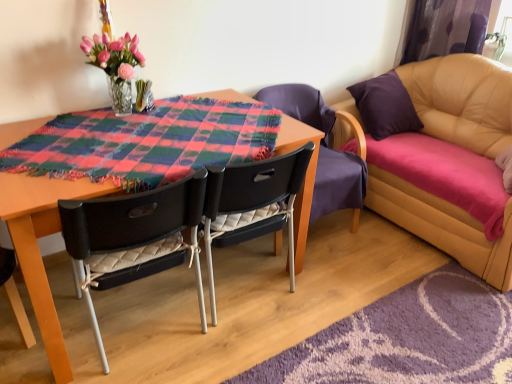
The height and width of the screenshot is (384, 512). Identify the location of black quilted fabric chair at center, the third chair positioned from the right. (133, 235).

Locate an element on the screen. black quilted chair at center, the third chair from the left is located at coordinates (324, 149).

The width and height of the screenshot is (512, 384). I want to click on purple shaggy rug at lower right, so click(407, 338).

The height and width of the screenshot is (384, 512). I want to click on purple fabric curtain at upper right, so click(x=445, y=28).

Which object is wider, black plastic chair at center, the second chair from the right, or black quilted chair at center, marked as the 1th chair in a right-to-left arrangement?

black quilted chair at center, marked as the 1th chair in a right-to-left arrangement, is wider.

Is black plastic chair at center, marked as the second chair in a left-to-right arrangement, closer to the viewer compared to black quilted chair at center, the third chair from the left?

That is True.

Who is shorter, black plastic chair at center, the second chair from the right, or black quilted chair at center, marked as the 1th chair in a right-to-left arrangement?

With less height is black plastic chair at center, the second chair from the right.

Which object is positioned more to the left, black plastic chair at center, marked as the second chair in a left-to-right arrangement, or black quilted chair at center, marked as the 1th chair in a right-to-left arrangement?

black plastic chair at center, marked as the second chair in a left-to-right arrangement.

Do you think black plastic chair at center, the second chair from the right, is within black quilted fabric chair at center, acting as the first chair starting from the left, or outside of it?

black plastic chair at center, the second chair from the right, cannot be found inside black quilted fabric chair at center, acting as the first chair starting from the left.

Does black plastic chair at center, marked as the second chair in a left-to-right arrangement, have a greater width compared to black quilted fabric chair at center, the third chair positioned from the right?

Correct, the width of black plastic chair at center, marked as the second chair in a left-to-right arrangement, exceeds that of black quilted fabric chair at center, the third chair positioned from the right.

Considering the positions of point (293, 273) and point (176, 231), is point (293, 273) closer or farther from the camera than point (176, 231)?

Point (293, 273) is positioned farther from the camera compared to point (176, 231).

Would you say black plastic chair at center, marked as the second chair in a left-to-right arrangement, contains plaid fabric at center?

That's incorrect, plaid fabric at center is not inside black plastic chair at center, marked as the second chair in a left-to-right arrangement.

Does point (292, 221) appear closer or farther from the camera than point (262, 110)?

Point (292, 221) is closer to the camera than point (262, 110).

Is the position of black plastic chair at center, marked as the second chair in a left-to-right arrangement, less distant than that of plaid fabric at center?

No, black plastic chair at center, marked as the second chair in a left-to-right arrangement, is behind plaid fabric at center.

Is black plastic chair at center, the second chair from the right, taller than plaid fabric at center?

Yes, black plastic chair at center, the second chair from the right, is taller than plaid fabric at center.

Is plaid fabric at center next to black quilted chair at center, the third chair from the left?

plaid fabric at center and black quilted chair at center, the third chair from the left, are not in contact.

Is point (152, 178) closer or farther from the camera than point (323, 175)?

Point (152, 178) appears to be closer to the viewer than point (323, 175).

Is plaid fabric at center taller than black quilted chair at center, the third chair from the left?

No.

Looking at the image, does plaid fabric at center seem bigger or smaller compared to black quilted chair at center, the third chair from the left?

Considering their sizes, plaid fabric at center takes up less space than black quilted chair at center, the third chair from the left.

Considering the sizes of objects black quilted fabric chair at center, the third chair positioned from the right, and plaid fabric at center in the image provided, who is thinner, black quilted fabric chair at center, the third chair positioned from the right, or plaid fabric at center?

black quilted fabric chair at center, the third chair positioned from the right.

Can you confirm if black quilted fabric chair at center, acting as the first chair starting from the left, is shorter than plaid fabric at center?

In fact, black quilted fabric chair at center, acting as the first chair starting from the left, may be taller than plaid fabric at center.

Could you tell me if black quilted fabric chair at center, acting as the first chair starting from the left, is facing plaid fabric at center?

No, black quilted fabric chair at center, acting as the first chair starting from the left, is not facing towards plaid fabric at center.

Looking at this image, which is less distant, (x=191, y=231) or (x=269, y=120)?

Positioned in front is point (x=191, y=231).

Do you think leather couch at right is within purple fabric curtain at upper right, or outside of it?

leather couch at right cannot be found inside purple fabric curtain at upper right.

Is leather couch at right beside purple fabric curtain at upper right?

They are not placed beside each other.

Is leather couch at right closer to camera compared to purple fabric curtain at upper right?

Yes, leather couch at right is closer to the viewer.

From a real-world perspective, between leather couch at right and purple fabric curtain at upper right, who is vertically lower?

From a 3D spatial view, leather couch at right is below.

Which is more to the right, translucent glass vase at upper left or purple fabric curtain at upper right?

Positioned to the right is purple fabric curtain at upper right.

Is translucent glass vase at upper left facing towards purple fabric curtain at upper right?

No, translucent glass vase at upper left is not turned towards purple fabric curtain at upper right.

Is translucent glass vase at upper left far from purple fabric curtain at upper right?

Yes, translucent glass vase at upper left and purple fabric curtain at upper right are quite far apart.

From a real-world perspective, does translucent glass vase at upper left sit lower than purple fabric curtain at upper right?

No, from a real-world perspective, translucent glass vase at upper left is not below purple fabric curtain at upper right.

I want to click on the 1st chair in front when counting from the black quilted chair at center, marked as the 1th chair in a right-to-left arrangement, so click(x=253, y=203).

Locate an element on the screen. chair that is the 1st object located behind the black quilted fabric chair at center, the third chair positioned from the right is located at coordinates (253, 203).

From the image, which object appears to be nearer to purple shaggy rug at lower right, black quilted fabric chair at center, acting as the first chair starting from the left, or purple fabric curtain at upper right?

black quilted fabric chair at center, acting as the first chair starting from the left, is positioned closer to the anchor purple shaggy rug at lower right.

From the image, which object appears to be nearer to black quilted chair at center, the third chair from the left, purple shaggy rug at lower right or plaid fabric at center?

The object closer to black quilted chair at center, the third chair from the left, is plaid fabric at center.

From the image, which object appears to be nearer to black plastic chair at center, marked as the second chair in a left-to-right arrangement, leather couch at right or black quilted chair at center, the third chair from the left?

black quilted chair at center, the third chair from the left, is closer to black plastic chair at center, marked as the second chair in a left-to-right arrangement.

When comparing their distances from purple fabric curtain at upper right, does black quilted fabric chair at center, the third chair positioned from the right, or plaid fabric at center seem closer?

The object closer to purple fabric curtain at upper right is plaid fabric at center.

Estimate the real-world distances between objects in this image. Which object is further from purple shaggy rug at lower right, translucent glass vase at upper left or plaid fabric at center?

Among the two, translucent glass vase at upper left is located further to purple shaggy rug at lower right.

When comparing their distances from black quilted chair at center, marked as the 1th chair in a right-to-left arrangement, does purple shaggy rug at lower right or black quilted fabric chair at center, acting as the first chair starting from the left, seem closer?

Among the two, purple shaggy rug at lower right is located nearer to black quilted chair at center, marked as the 1th chair in a right-to-left arrangement.

Looking at the image, which one is located further to black quilted chair at center, marked as the 1th chair in a right-to-left arrangement, leather couch at right or purple fabric curtain at upper right?

purple fabric curtain at upper right is further to black quilted chair at center, marked as the 1th chair in a right-to-left arrangement.

When comparing their distances from plaid fabric at center, does black quilted fabric chair at center, acting as the first chair starting from the left, or translucent glass vase at upper left seem further?

translucent glass vase at upper left.

I want to click on cloth between translucent glass vase at upper left and purple fabric curtain at upper right, so click(x=147, y=142).

At what (x,y) coordinates should I click in order to perform the action: click on chair between black plastic chair at center, marked as the second chair in a left-to-right arrangement, and purple fabric curtain at upper right from left to right. Please return your answer as a coordinate pair (x, y). Looking at the image, I should click on [x=324, y=149].

The image size is (512, 384). In order to click on cloth between black quilted fabric chair at center, acting as the first chair starting from the left, and purple shaggy rug at lower right in this screenshot , I will do `click(147, 142)`.

You are a GUI agent. You are given a task and a screenshot of the screen. Output one action in this format:
    pyautogui.click(x=<x>, y=<y>)
    Task: Click on the place mat situated between black plastic chair at center, the second chair from the right, and leather couch at right from left to right
    The image size is (512, 384).
    Given the screenshot: What is the action you would take?
    pyautogui.click(x=407, y=338)